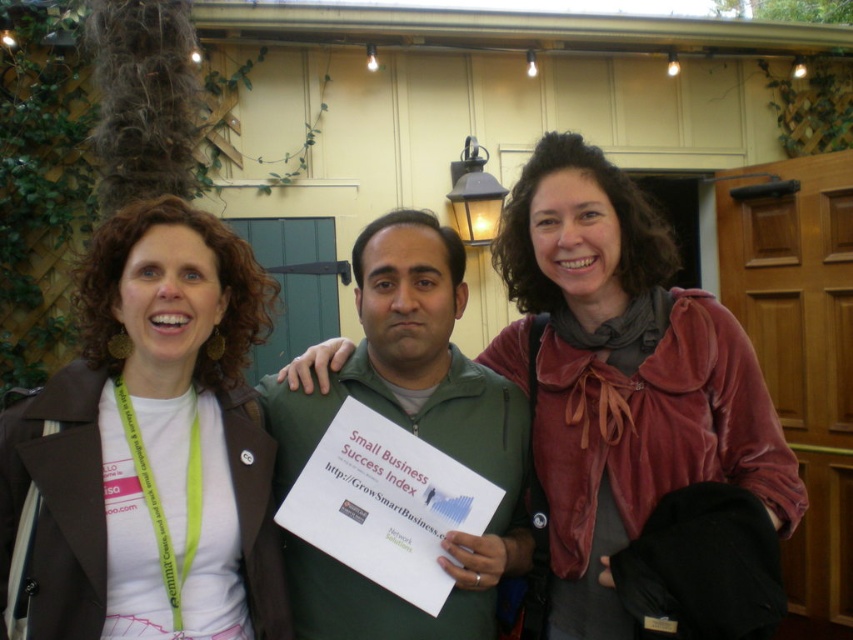
Question: Which point is closer to the camera?

Choices:
 (A) green matte jacket at center
 (B) matte brown jacket at left
 (C) velvet red scarf at center

Answer: (B)

Question: Which point is closer to the camera?

Choices:
 (A) (561, 336)
 (B) (231, 275)

Answer: (B)

Question: Does matte brown jacket at left lie in front of velvet red scarf at center?

Choices:
 (A) yes
 (B) no

Answer: (A)

Question: Can you confirm if matte brown jacket at left is positioned below green matte jacket at center?

Choices:
 (A) no
 (B) yes

Answer: (A)

Question: In this image, where is matte brown jacket at left located relative to velvet red scarf at center?

Choices:
 (A) below
 (B) above

Answer: (A)

Question: Which point is closer to the camera taking this photo?

Choices:
 (A) (183, 326)
 (B) (651, 362)

Answer: (A)